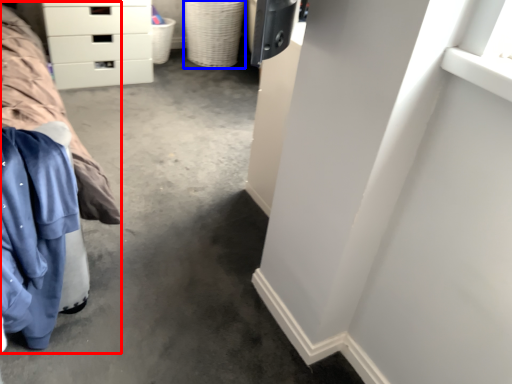
Question: Which of the following is the closest to the observer, bed (highlighted by a red box) or basket (highlighted by a blue box)?

Choices:
 (A) bed
 (B) basket

Answer: (A)